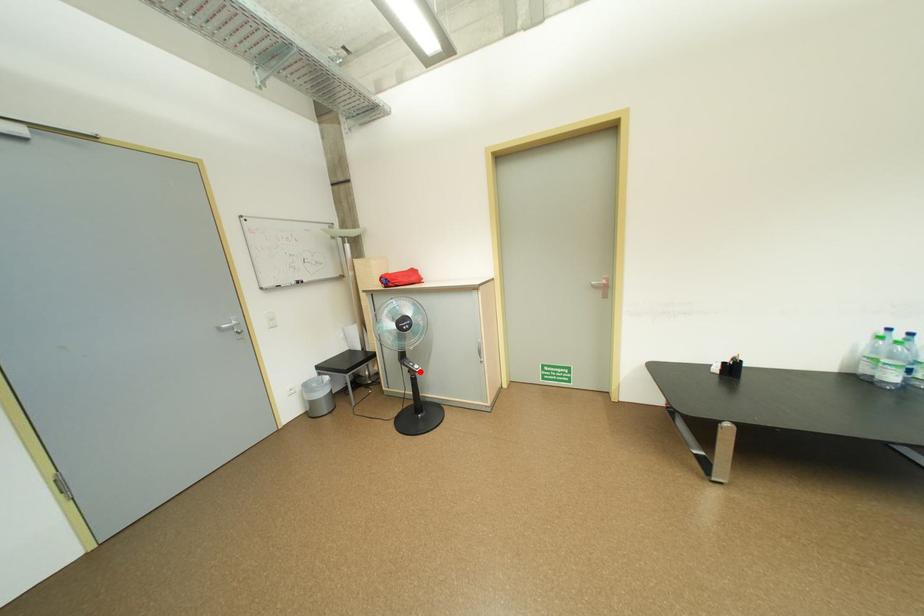
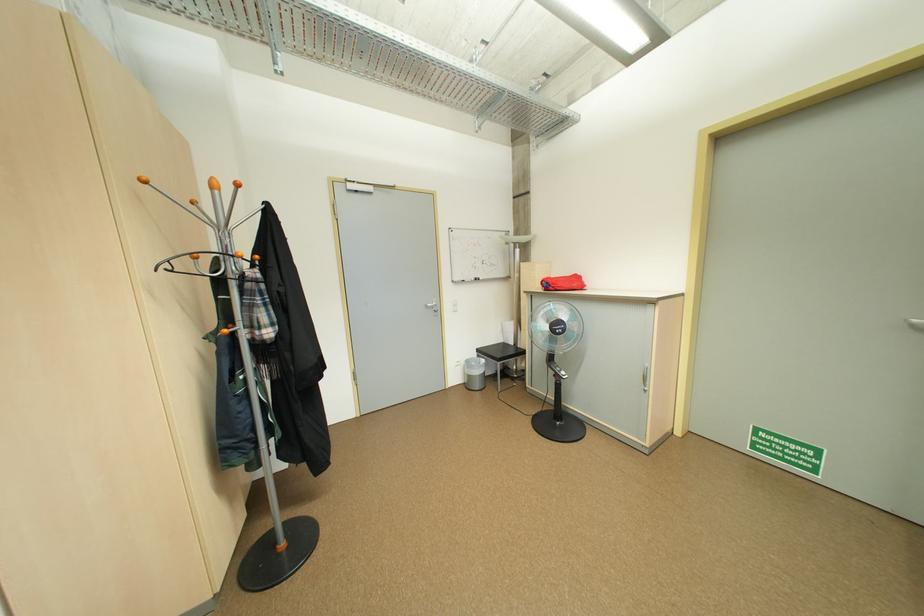
Locate, in the second image, the point that corresponds to the highlighted location in the first image.

(565, 377)